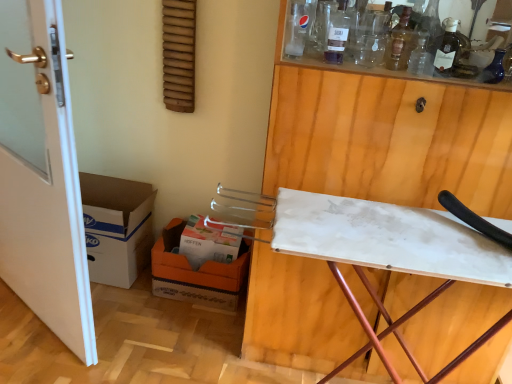
Question: Considering the relative sizes of orange cardboard box at lower left, which is counted as the first cardboard box, starting from the right, and white marble ironing board at upper right in the image provided, is orange cardboard box at lower left, which is counted as the first cardboard box, starting from the right, thinner than white marble ironing board at upper right?

Choices:
 (A) yes
 (B) no

Answer: (A)

Question: Is orange cardboard box at lower left, which is counted as the first cardboard box, starting from the right, positioned before white marble ironing board at upper right?

Choices:
 (A) no
 (B) yes

Answer: (A)

Question: Does orange cardboard box at lower left, which is counted as the first cardboard box, starting from the right, have a greater height compared to white marble ironing board at upper right?

Choices:
 (A) yes
 (B) no

Answer: (B)

Question: Is orange cardboard box at lower left, which is counted as the second cardboard box, starting from the left, facing towards white marble ironing board at upper right?

Choices:
 (A) yes
 (B) no

Answer: (B)

Question: From the image's perspective, is orange cardboard box at lower left, which is counted as the second cardboard box, starting from the left, located above white marble ironing board at upper right?

Choices:
 (A) no
 (B) yes

Answer: (A)

Question: Can you confirm if orange cardboard box at lower left, which is counted as the first cardboard box, starting from the right, is positioned to the left of white marble ironing board at upper right?

Choices:
 (A) no
 (B) yes

Answer: (B)

Question: Considering the relative sizes of translucent glass bottle at upper right, the 2th wine bottle viewed from the right, and white glossy door at left in the image provided, is translucent glass bottle at upper right, the 2th wine bottle viewed from the right, shorter than white glossy door at left?

Choices:
 (A) no
 (B) yes

Answer: (B)

Question: Is translucent glass bottle at upper right, placed as the 1th wine bottle when sorted from left to right, facing towards white glossy door at left?

Choices:
 (A) yes
 (B) no

Answer: (B)

Question: Can you confirm if translucent glass bottle at upper right, placed as the 1th wine bottle when sorted from left to right, is wider than white glossy door at left?

Choices:
 (A) yes
 (B) no

Answer: (B)

Question: Is translucent glass bottle at upper right, placed as the 1th wine bottle when sorted from left to right, located outside white glossy door at left?

Choices:
 (A) no
 (B) yes

Answer: (B)

Question: Considering the relative sizes of translucent glass bottle at upper right, the 2th wine bottle viewed from the right, and white glossy door at left in the image provided, is translucent glass bottle at upper right, the 2th wine bottle viewed from the right, taller than white glossy door at left?

Choices:
 (A) yes
 (B) no

Answer: (B)

Question: From a real-world perspective, is translucent glass bottle at upper right, placed as the 1th wine bottle when sorted from left to right, positioned over white glossy door at left based on gravity?

Choices:
 (A) no
 (B) yes

Answer: (B)

Question: Is white marble ironing board at upper right wider than transparent glass bottle at upper center?

Choices:
 (A) no
 (B) yes

Answer: (B)